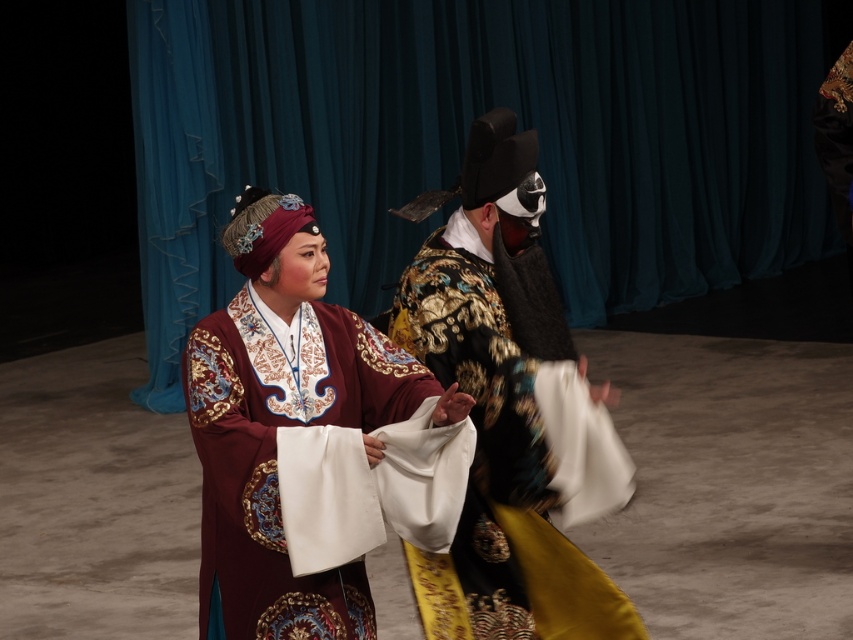
Question: Does gold brocade robe at center appear over velvet maroon robe at center?

Choices:
 (A) yes
 (B) no

Answer: (A)

Question: Which point is farther to the camera?

Choices:
 (A) velvet maroon robe at center
 (B) gold brocade robe at center

Answer: (B)

Question: Can you confirm if gold brocade robe at center is thinner than velvet maroon robe at center?

Choices:
 (A) no
 (B) yes

Answer: (A)

Question: Is gold brocade robe at center positioned in front of velvet maroon robe at center?

Choices:
 (A) yes
 (B) no

Answer: (B)